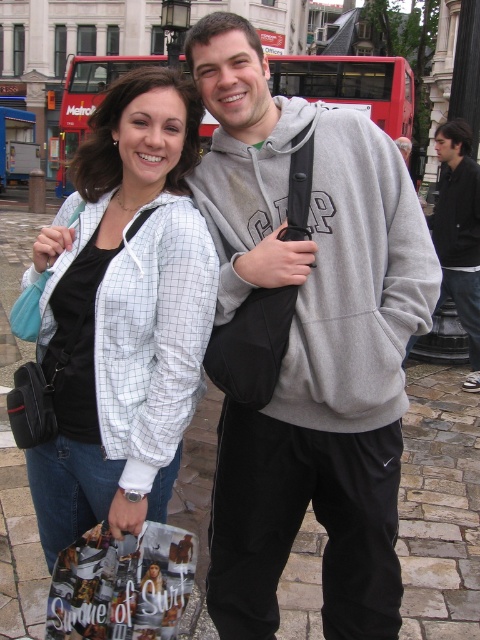
Question: Considering the relative positions of gray cotton hoodie at center and white checkered jacket at upper left in the image provided, where is gray cotton hoodie at center located with respect to white checkered jacket at upper left?

Choices:
 (A) right
 (B) left

Answer: (A)

Question: Which point is farther to the camera?

Choices:
 (A) gray cotton hoodie at center
 (B) white checkered jacket at upper left

Answer: (A)

Question: Does gray cotton hoodie at center have a greater width compared to black cotton hoodie at center?

Choices:
 (A) yes
 (B) no

Answer: (B)

Question: Which object is positioned closest to the gray cotton hoodie at center?

Choices:
 (A) white checkered jacket at upper left
 (B) black cotton hoodie at center

Answer: (A)

Question: Is gray cotton hoodie at center smaller than white checkered jacket at upper left?

Choices:
 (A) no
 (B) yes

Answer: (A)

Question: Which of the following is the farthest from the observer?

Choices:
 (A) (336, 557)
 (B) (476, 186)

Answer: (B)